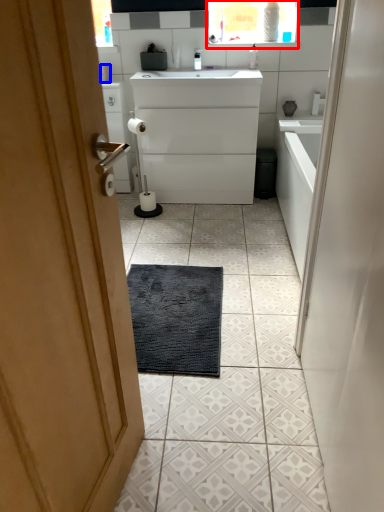
Question: Which object is closer to the camera taking this photo, medicine cabinet (highlighted by a red box) or toilet paper (highlighted by a blue box)?

Choices:
 (A) medicine cabinet
 (B) toilet paper

Answer: (A)